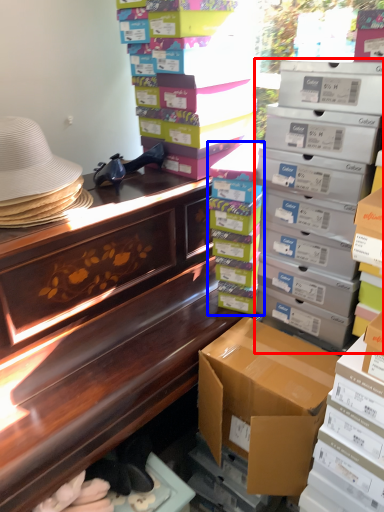
Question: Which of the following is the closest to the observer, box (highlighted by a red box) or box (highlighted by a blue box)?

Choices:
 (A) box
 (B) box

Answer: (A)